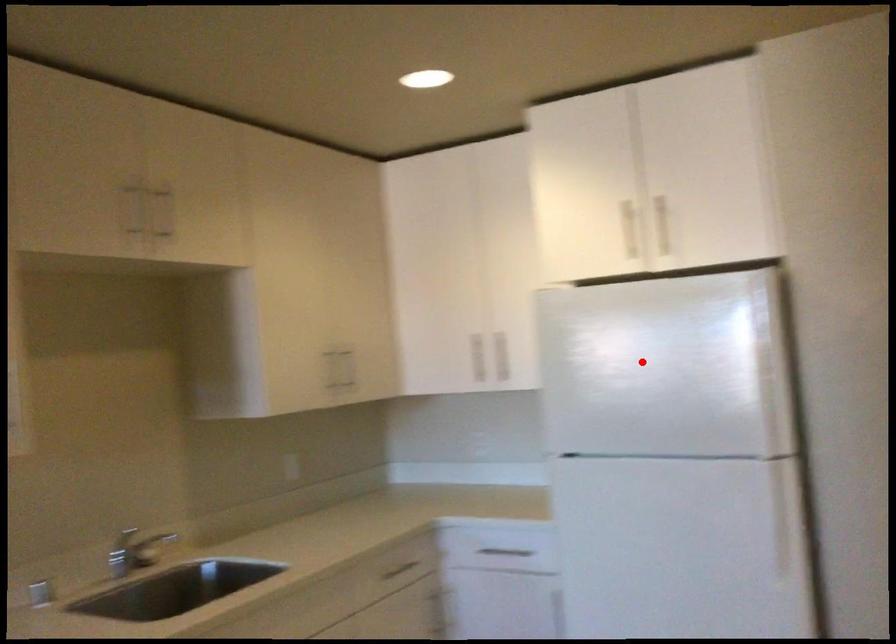
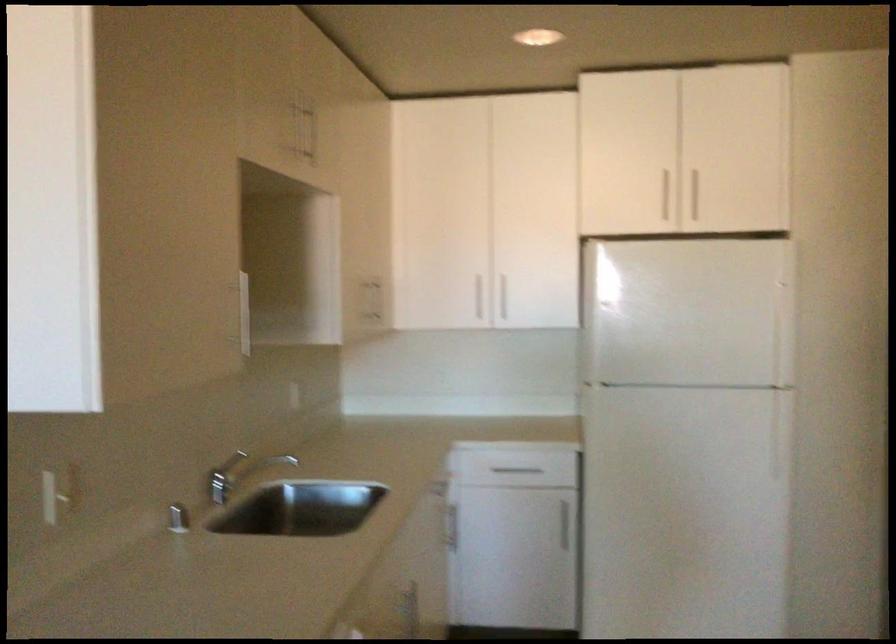
Question: I am providing you with two images of the same scene from different viewpoints. Given a red point in image1, look at the same physical point in image2. Is it:

Choices:
 (A) Closer to the viewpoint
 (B) Farther from the viewpoint

Answer: (B)